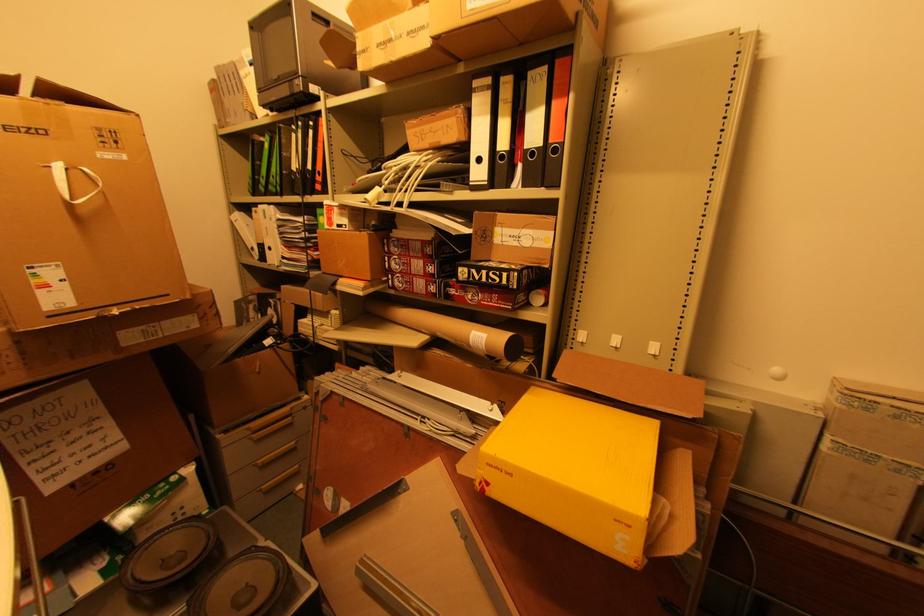
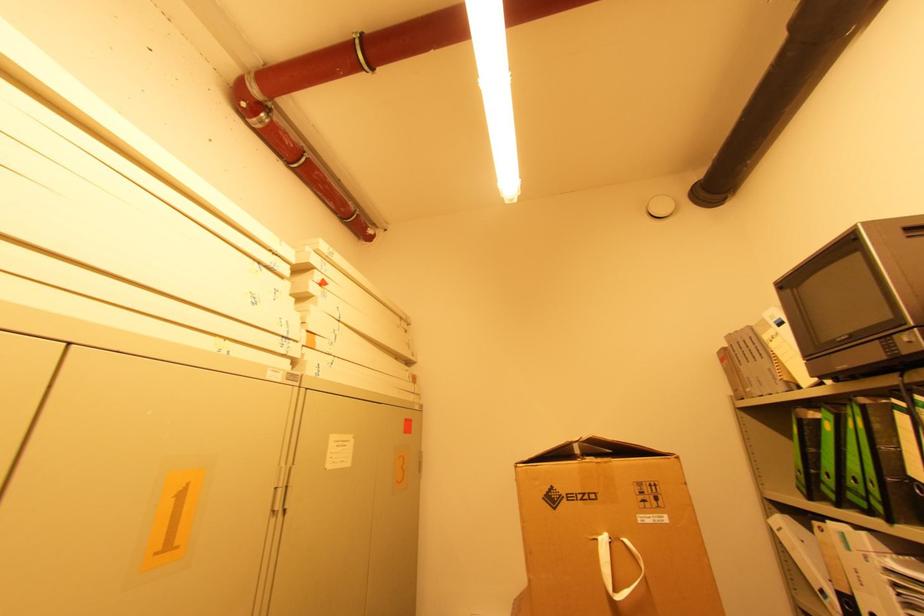
In the second image, find the point that corresponds to pixel 262 180 in the first image.

(822, 476)